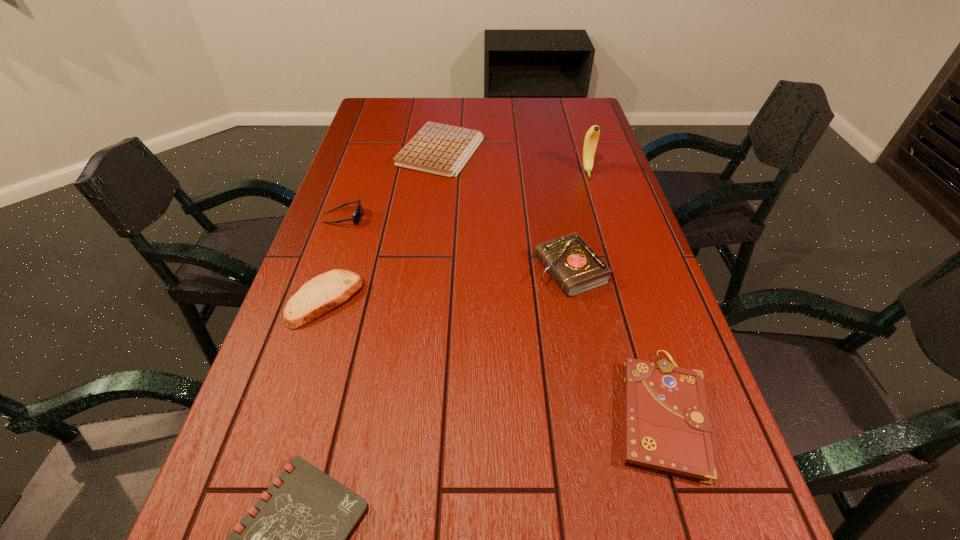
Find the location of a particular element. The image size is (960, 540). free space located on the front-facing side of the fifth shortest object is located at coordinates (420, 218).

This screenshot has width=960, height=540. I want to click on vacant space located on the back of the pita bread, so click(x=344, y=241).

Identify the location of vacant space located 0.240m on the back of the rightmost notebook. This screenshot has width=960, height=540. (618, 273).

What are the coordinates of `vacant area situated on the right of the second shortest notebook` in the screenshot? It's located at (514, 152).

The image size is (960, 540). In order to click on sunglasses that is at the left edge in this screenshot , I will do (x=358, y=212).

What are the coordinates of `pita bread at the left edge` in the screenshot? It's located at coord(321,294).

Locate an element on the screen. This screenshot has height=540, width=960. notebook present at the left edge is located at coordinates (440, 149).

This screenshot has height=540, width=960. In order to click on banana that is at the right edge in this screenshot , I will do `click(591, 139)`.

Where is `diary that is at the right edge`? diary that is at the right edge is located at coordinates (576, 268).

You are a GUI agent. You are given a task and a screenshot of the screen. Output one action in this format:
    pyautogui.click(x=<x>, y=<y>)
    Task: Click on the notebook positioned at the right edge
    
    Given the screenshot: What is the action you would take?
    pyautogui.click(x=667, y=429)